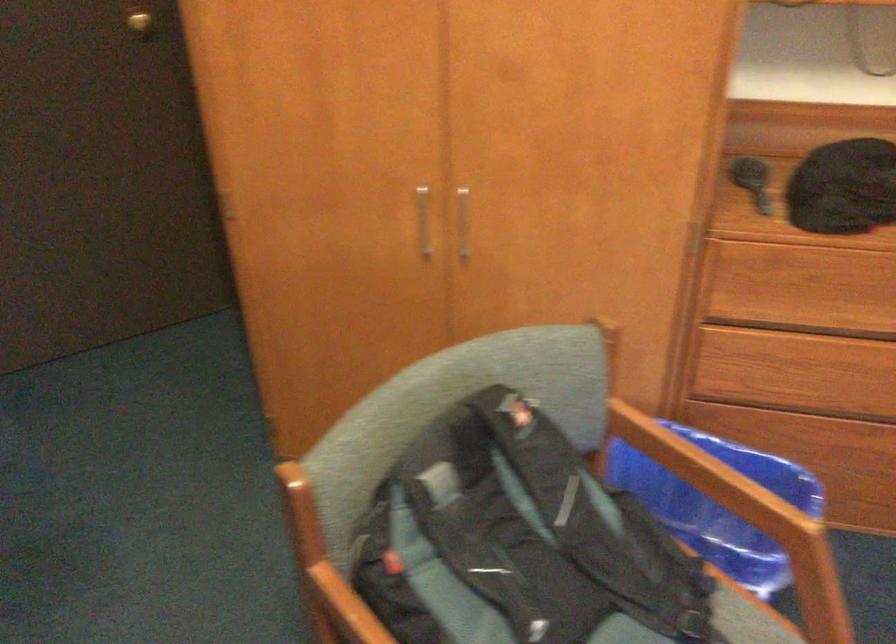
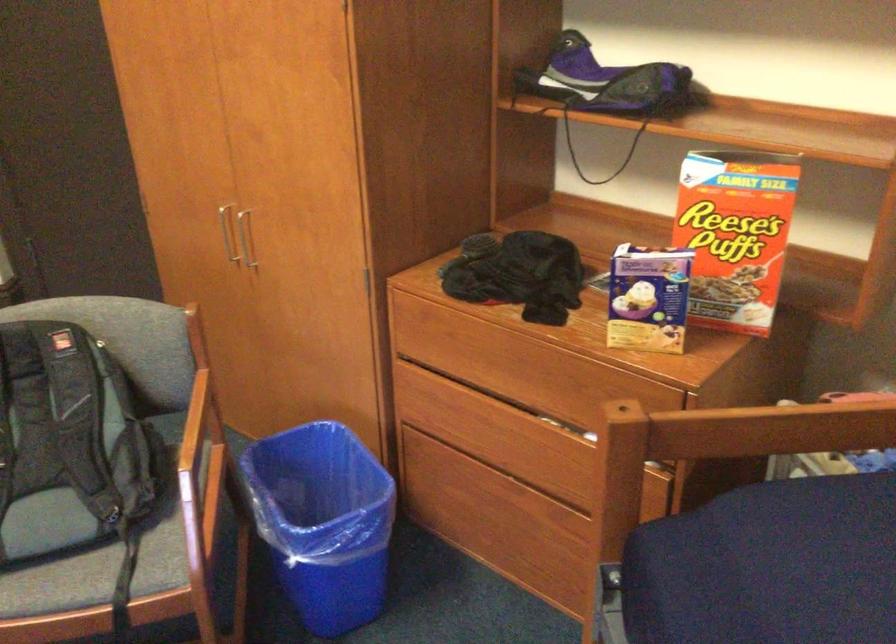
Question: The images are taken continuously from a first-person perspective. In which direction are you moving?

Choices:
 (A) Left
 (B) Right
 (C) Forward
 (D) Backward

Answer: (B)